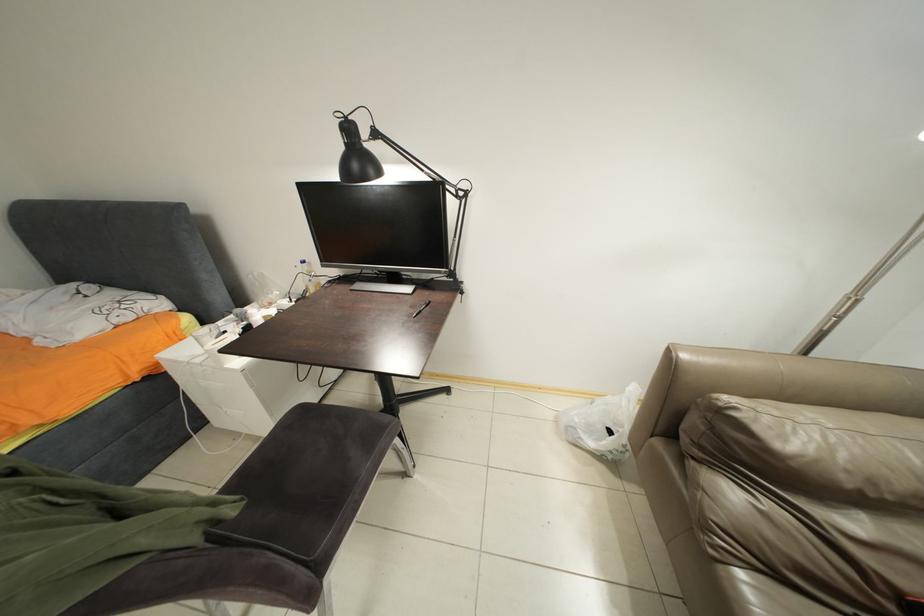
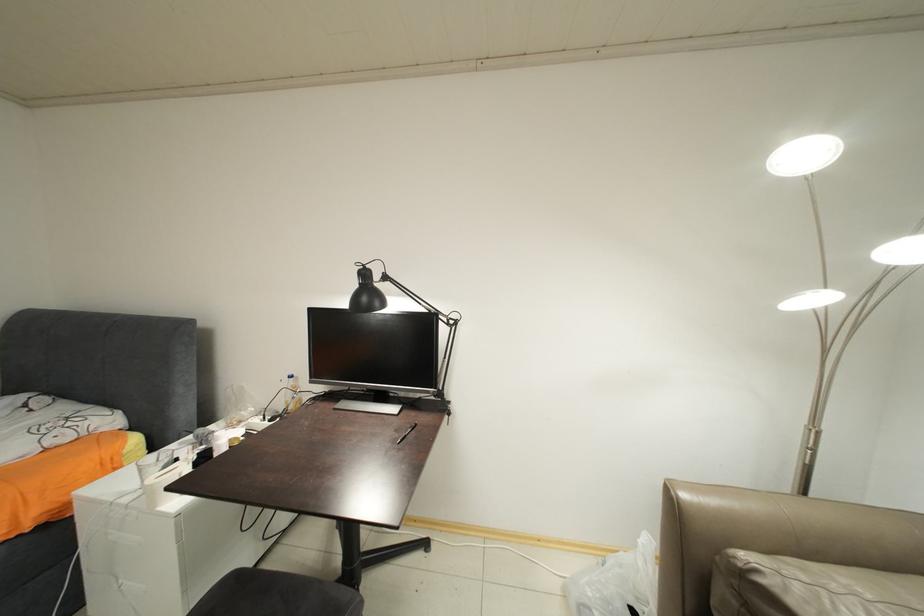
Question: In a continuous first-person perspective shot, in which direction is the camera moving?

Choices:
 (A) Left
 (B) Right
 (C) Forward
 (D) Backward

Answer: (D)